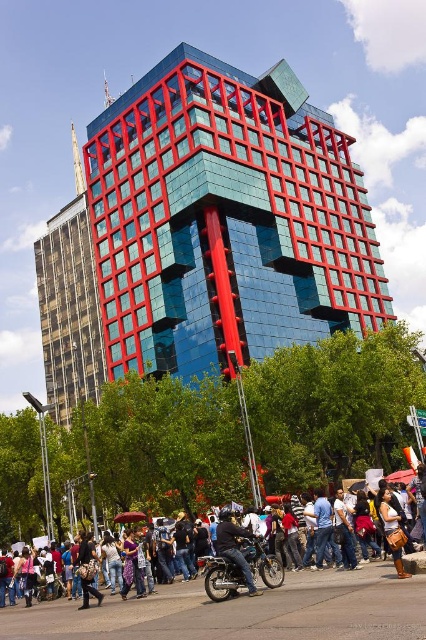
Based on the photo, who is positioned more to the right, matte black crowd at lower center or shiny chrome motorbike at center?

From the viewer's perspective, shiny chrome motorbike at center appears more on the right side.

Is point (229, 589) positioned before point (255, 560)?

Yes, point (229, 589) is closer to viewer.

What do you see at coordinates (221, 577) in the screenshot? The width and height of the screenshot is (426, 640). I see `matte black crowd at lower center` at bounding box center [221, 577].

You are a GUI agent. You are given a task and a screenshot of the screen. Output one action in this format:
    pyautogui.click(x=<x>, y=<y>)
    Task: Click on the matte black crowd at lower center
    
    Given the screenshot: What is the action you would take?
    pyautogui.click(x=221, y=577)

Does matte black crowd at lower center appear on the right side of shiny black motorcycle at center?

Incorrect, matte black crowd at lower center is not on the right side of shiny black motorcycle at center.

Consider the image. Can you confirm if matte black crowd at lower center is bigger than shiny black motorcycle at center?

Yes.

The width and height of the screenshot is (426, 640). Find the location of `matte black crowd at lower center`. matte black crowd at lower center is located at coordinates (221, 577).

Identify the location of matte black crowd at lower center. (221, 577).

Is shiny chrome motorbike at center below shiny black motorcycle at center?

Yes.

Which of these two, shiny chrome motorbike at center or shiny black motorcycle at center, stands taller?

With more height is shiny chrome motorbike at center.

Where is `shiny chrome motorbike at center`? Image resolution: width=426 pixels, height=640 pixels. shiny chrome motorbike at center is located at coordinates (221, 577).